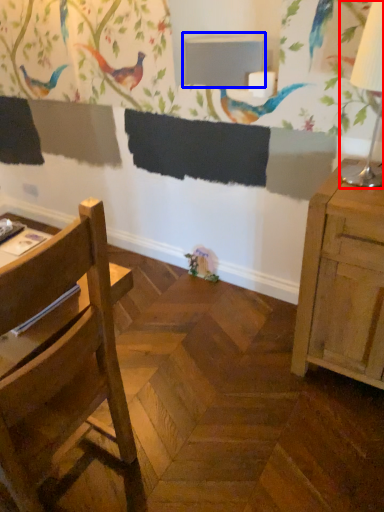
Question: Among these objects, which one is farthest to the camera, table lamp (highlighted by a red box) or table (highlighted by a blue box)?

Choices:
 (A) table lamp
 (B) table

Answer: (B)